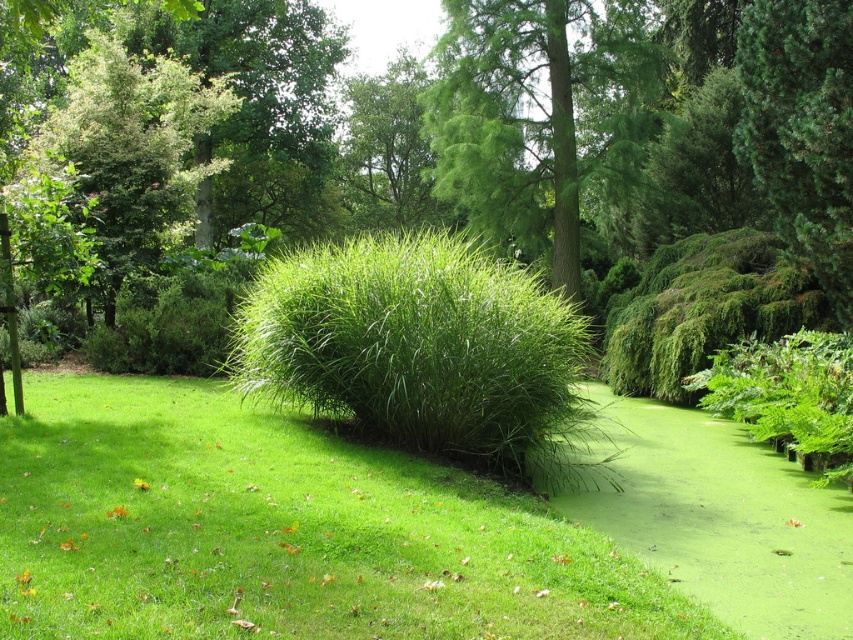
Can you confirm if green leafy tree at center is taller than green needle-like at upper right?

Yes, green leafy tree at center is taller than green needle-like at upper right.

Who is more forward, [474,60] or [782,236]?

Point [782,236] is in front.

This screenshot has width=853, height=640. I want to click on green leafy tree at center, so click(x=540, y=115).

At what (x,y) coordinates should I click in order to perform the action: click on green leafy tree at center. Please return your answer as a coordinate pair (x, y). Looking at the image, I should click on (540, 115).

Is point (422, 440) closer to viewer compared to point (799, 19)?

Yes, it is.

Can you confirm if green leafy bush at center is positioned above green needle-like at upper right?

No, green leafy bush at center is not above green needle-like at upper right.

Image resolution: width=853 pixels, height=640 pixels. What are the coordinates of `green leafy bush at center` in the screenshot? It's located at (427, 353).

The height and width of the screenshot is (640, 853). In order to click on green leafy bush at center in this screenshot , I will do `click(427, 353)`.

Can you confirm if green leafy grass at center is wider than green leafy tree at center?

In fact, green leafy grass at center might be narrower than green leafy tree at center.

Between green leafy grass at center and green leafy tree at center, which one appears on the right side from the viewer's perspective?

From the viewer's perspective, green leafy tree at center appears more on the right side.

Where is `green leafy grass at center`? The width and height of the screenshot is (853, 640). green leafy grass at center is located at coordinates (283, 531).